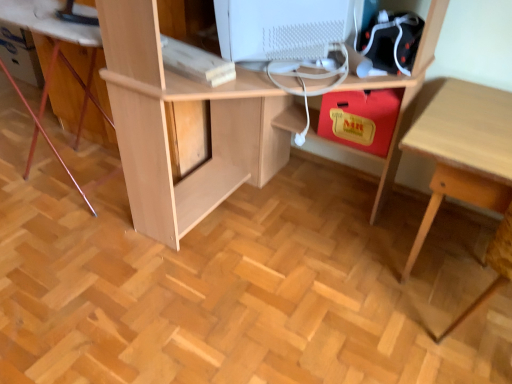
Question: Does point (452, 183) appear closer or farther from the camera than point (96, 33)?

Choices:
 (A) farther
 (B) closer

Answer: (A)

Question: Is light wood table at lower right spatially inside light wood computer desk at lower left, or outside of it?

Choices:
 (A) outside
 (B) inside

Answer: (A)

Question: Which of these objects is positioned farthest from the light wood table at lower right?

Choices:
 (A) light wood computer desk at lower left
 (B) light wood desk at center
 (C) white matte computer monitor at upper center

Answer: (A)

Question: Which of these objects is positioned farthest from the white matte computer monitor at upper center?

Choices:
 (A) light wood table at lower right
 (B) light wood computer desk at lower left
 (C) light wood desk at center

Answer: (B)